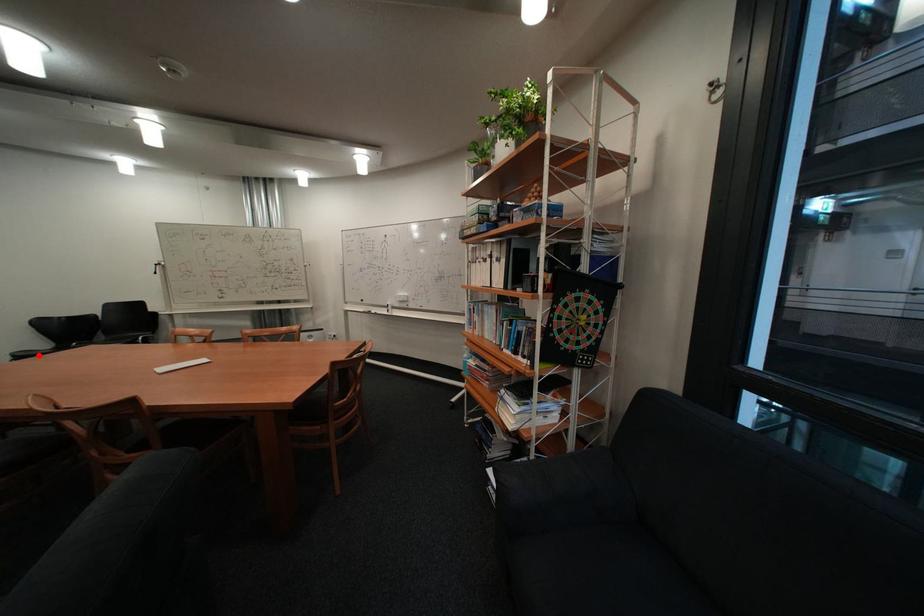
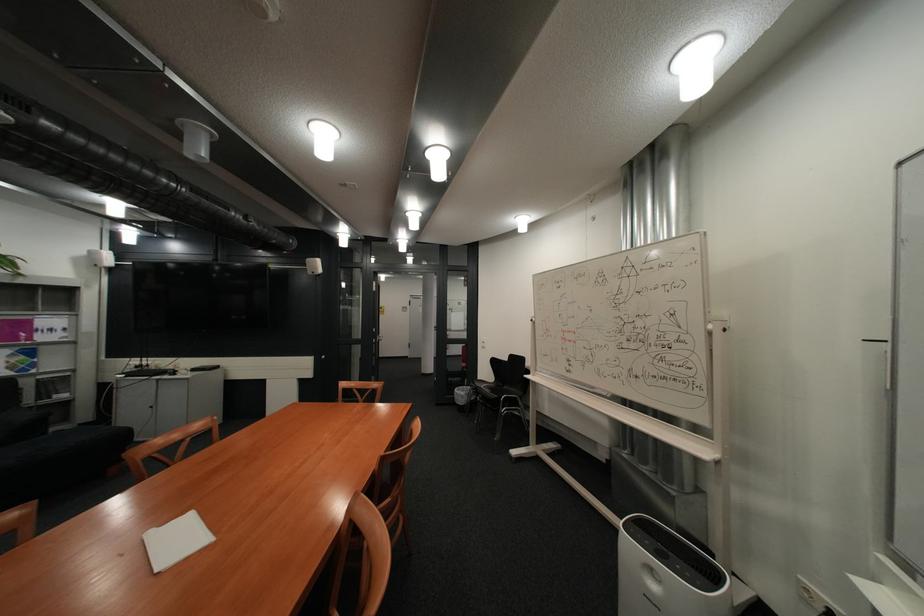
The point at the highlighted location is marked in the first image. Where is the corresponding point in the second image?

(493, 383)